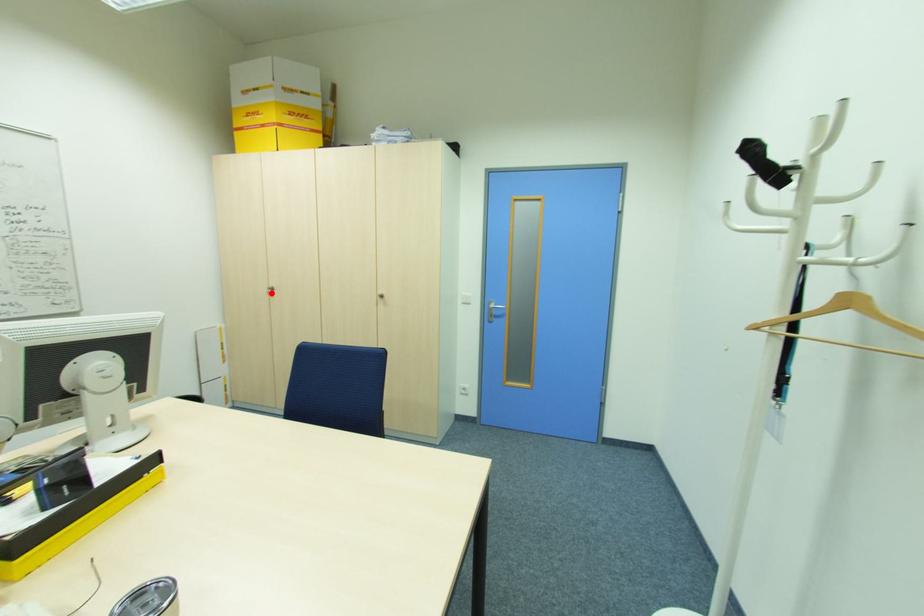
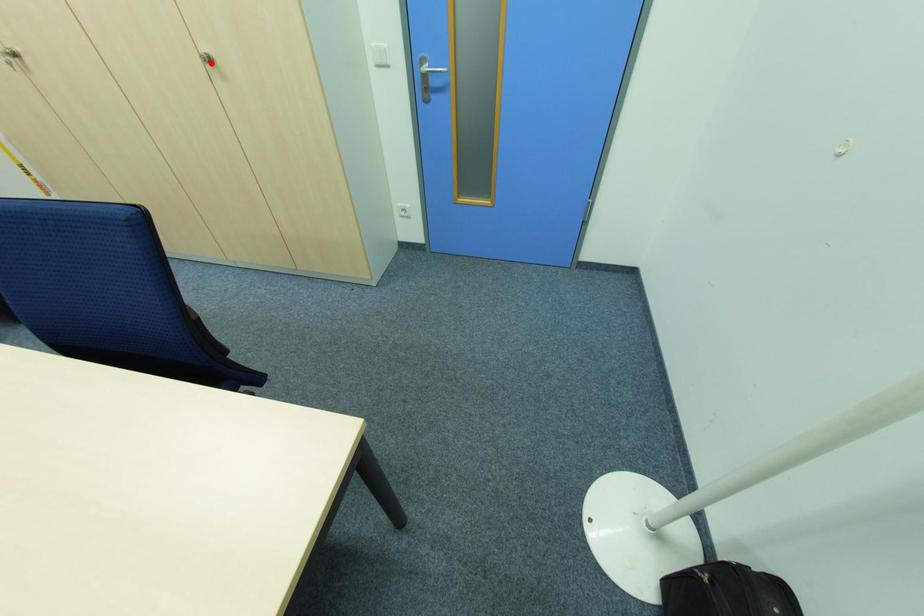
I am providing you with two images of the same scene from different viewpoints. A red point is marked on the first image and another point is marked on the second image. Are the points marked in image1 and image2 representing the same 3D position?

No